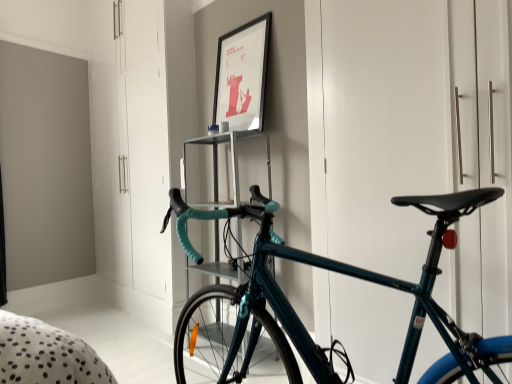
Question: In terms of width, does teal glossy bicycle at center look wider or thinner when compared to matte black picture frame at upper center?

Choices:
 (A) thin
 (B) wide

Answer: (B)

Question: Considering their positions, is teal glossy bicycle at center located in front of or behind matte black picture frame at upper center?

Choices:
 (A) front
 (B) behind

Answer: (A)

Question: Considering the real-world distances, which object is closest to the teal glossy bicycle at center?

Choices:
 (A) white glossy dresser at center
 (B) teal glossy bicycle at right
 (C) metallic silver shelf at center
 (D) matte black picture frame at upper center

Answer: (B)

Question: Which object is the farthest from the matte black picture frame at upper center?

Choices:
 (A) white glossy dresser at center
 (B) teal glossy bicycle at center
 (C) metallic silver shelf at center
 (D) teal glossy bicycle at right

Answer: (B)